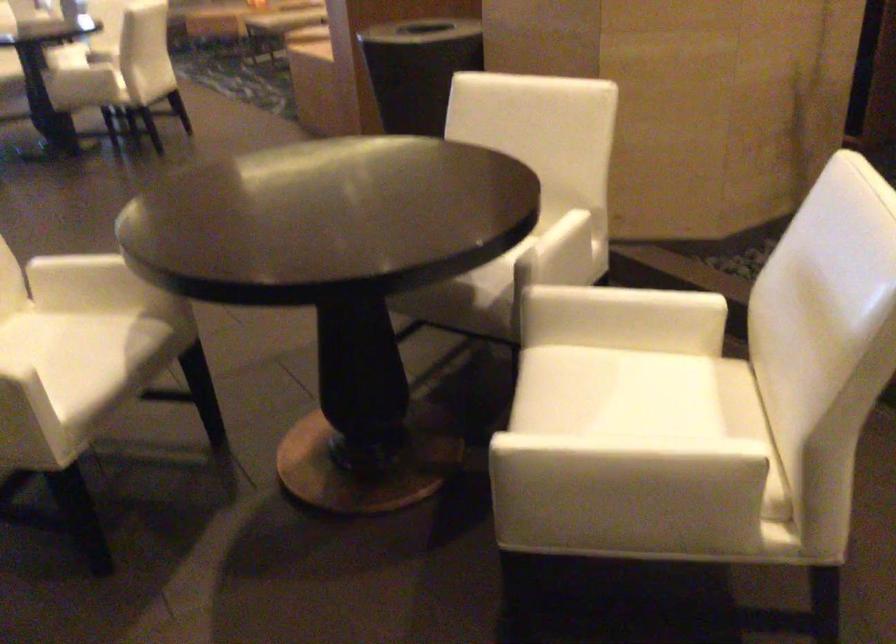
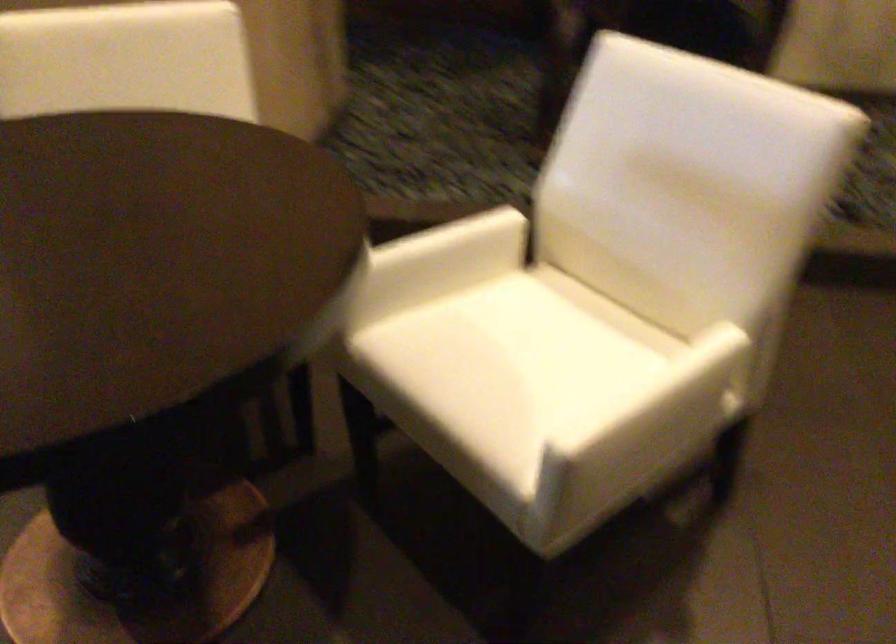
In the second image, find the point that corresponds to point 634,408 in the first image.

(533, 348)